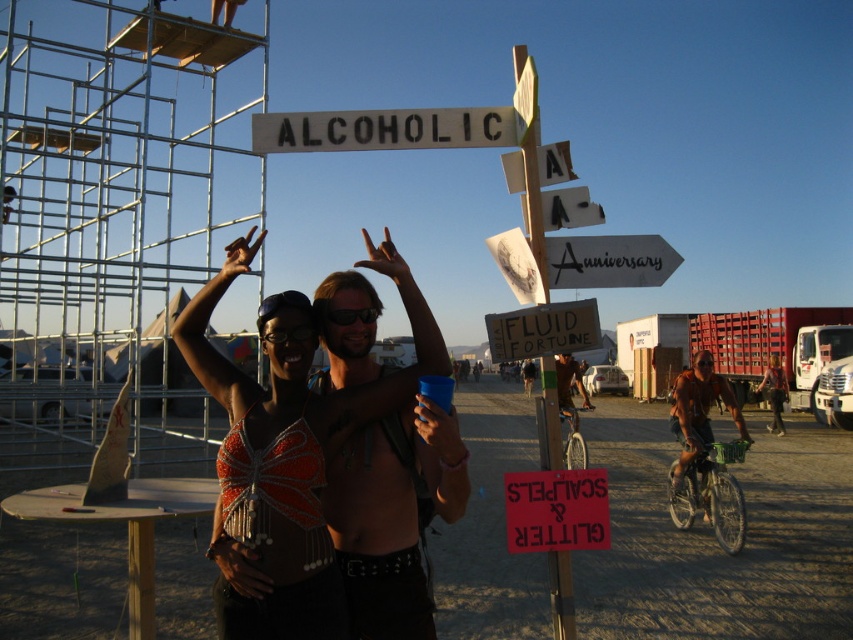
Who is more distant from viewer, (428, 109) or (567, 147)?

Positioned behind is point (567, 147).

Between white painted wood sign at upper center and white wooden signpost at upper center, which one is positioned higher?

white wooden signpost at upper center

Is point (473, 131) closer to camera compared to point (512, 156)?

Yes, point (473, 131) is closer to viewer.

Where is `white painted wood sign at upper center`? The width and height of the screenshot is (853, 640). white painted wood sign at upper center is located at coordinates (383, 129).

Between white painted wood sign at upper center and shiny metallic bicycle at center, which one is positioned higher?

white painted wood sign at upper center is above.

Which is in front, point (279, 145) or point (569, 385)?

Positioned in front is point (279, 145).

Image resolution: width=853 pixels, height=640 pixels. I want to click on white painted wood sign at upper center, so click(x=383, y=129).

Does shiny metallic torso at center have a lesser width compared to white plastic sign at upper center?

No.

Who is positioned more to the left, shiny metallic torso at center or white plastic sign at upper center?

Positioned to the left is shiny metallic torso at center.

Which is in front, point (347, 364) or point (592, 202)?

Point (347, 364) is in front.

Identify the location of shiny metallic torso at center. (393, 516).